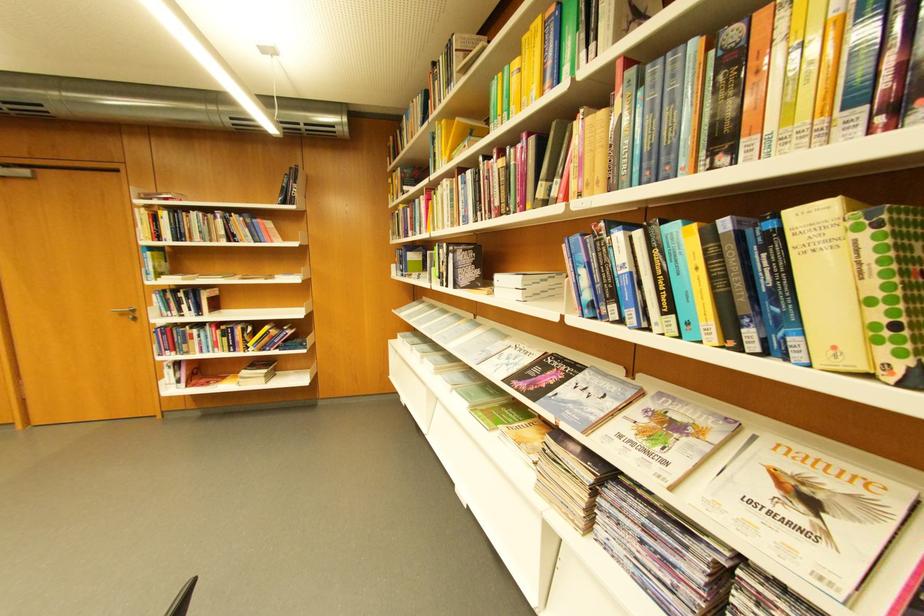
Image resolution: width=924 pixels, height=616 pixels. What do you see at coordinates (126, 312) in the screenshot?
I see `a silver door handle` at bounding box center [126, 312].